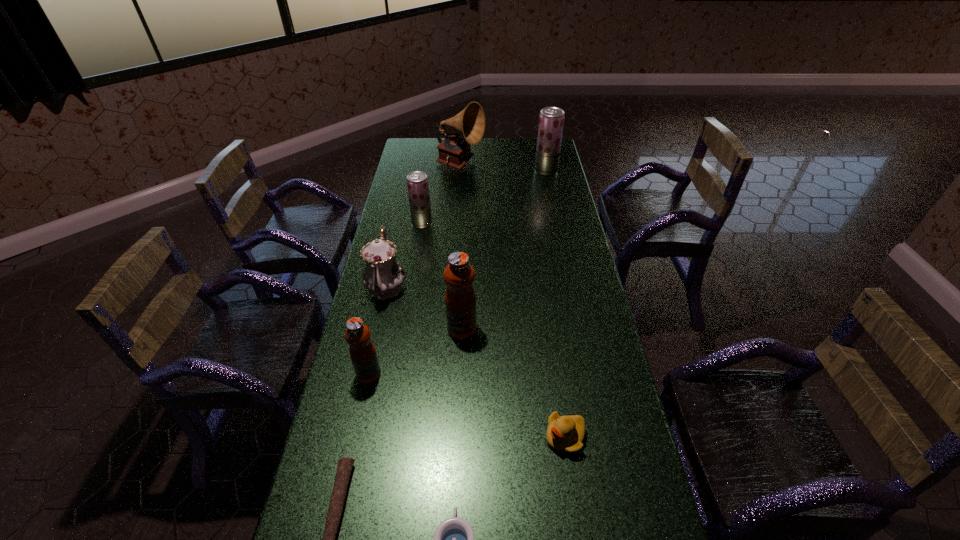
Find the location of `yellow duckling`. yellow duckling is located at coordinates (565, 434).

Where is `duckling`? duckling is located at coordinates pos(565,434).

Image resolution: width=960 pixels, height=540 pixels. In order to click on vacant point located 0.250m on the horn of the phonograph record in this screenshot , I will do `click(535, 165)`.

The image size is (960, 540). In order to click on free point located on the back of the farther strawberry fruit juice in this screenshot , I will do `click(540, 140)`.

What are the coordinates of `vacant space located 0.240m on the front label of the second fruit juice from right to left` in the screenshot? It's located at (459, 408).

Identify the location of vacant region located 0.210m on the right of the second farthest fruit juice. (482, 223).

The image size is (960, 540). I want to click on vacant space located on the front label of the nearer orange fruit juice, so click(418, 373).

Where is `free location located 0.100m on the front of the sixth nearest object`? free location located 0.100m on the front of the sixth nearest object is located at coordinates (376, 332).

Where is `vacant space located 0.170m on the beak of the yellow duckling`? This screenshot has height=540, width=960. vacant space located 0.170m on the beak of the yellow duckling is located at coordinates (x=481, y=437).

Identify the location of vacant space located on the beak of the yellow duckling. The image size is (960, 540). (495, 437).